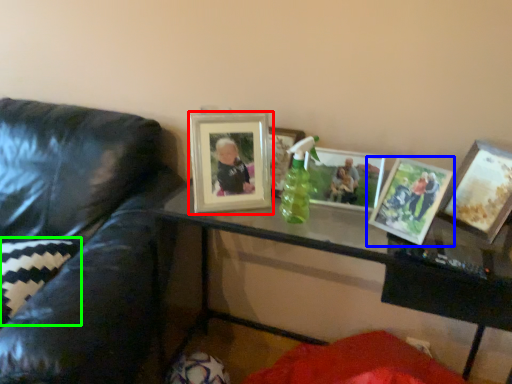
Question: Which object is positioned closest to picture frame (highlighted by a red box)? Select from picture frame (highlighted by a blue box) and pillow (highlighted by a green box).

Choices:
 (A) picture frame
 (B) pillow

Answer: (A)